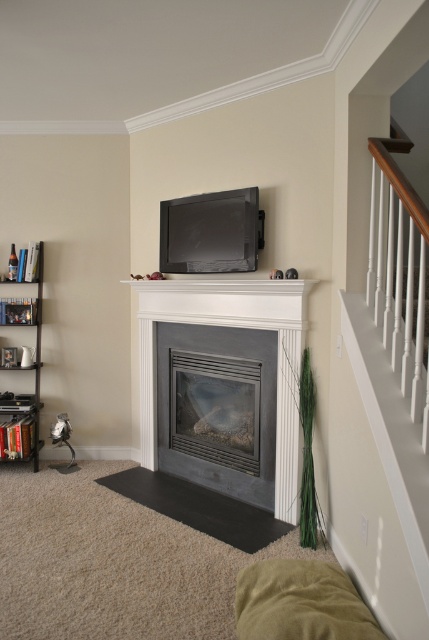
You are planning to hang a large painting that requires a 1.8 meter height clearance. You have two options to hang it above either the matte black fireplace at center or the metallic silver bookshelf at left. Based on their heights, which object allows the painting to be hung without any issues?

The metallic silver bookshelf at left is taller than the matte black fireplace at center, so hanging the painting above the metallic silver bookshelf at left would provide sufficient height clearance for the painting.

You are standing in the living room and want to place a new painting between the matte black fireplace at center and the white glossy fireplace at center. Based on their positions, where should you place the painting?

The matte black fireplace at center is to the left of the white glossy fireplace at center, so you should place the painting to the right of the matte black fireplace at center and to the left of the white glossy fireplace at center between them.

You are a delivery person who just arrived at the house to install a new 17 inch wide entertainment stand between the white glossy fireplace at center and the matte black tv at upper center. Can the stand fit in the space between them?

The white glossy fireplace at center is 16.98 inches away from the matte black tv at upper center. Since the entertainment stand is 17 inches wide, it cannot fit in the space between them as the distance is slightly less than the required width.